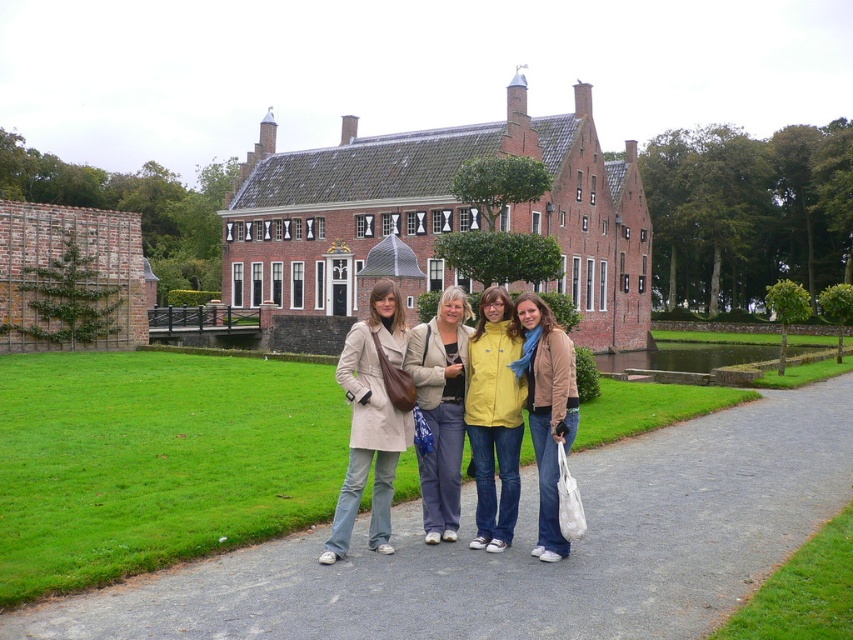
Which is behind, point (35, 634) or point (544, 326)?

The point (544, 326) is more distant.

Does gray asphalt path at center appear under matte beige jacket at center?

Yes, gray asphalt path at center is below matte beige jacket at center.

Which is behind, point (624, 604) or point (535, 362)?

Point (535, 362)

The height and width of the screenshot is (640, 853). I want to click on gray asphalt path at center, so click(527, 547).

Does beige fabric coat at center have a greater width compared to light beige coat at center?

Correct, the width of beige fabric coat at center exceeds that of light beige coat at center.

Is beige fabric coat at center smaller than light beige coat at center?

Indeed, beige fabric coat at center has a smaller size compared to light beige coat at center.

Between point (351, 518) and point (468, 326), which one is positioned in front?

Positioned in front is point (351, 518).

This screenshot has height=640, width=853. I want to click on beige fabric coat at center, so click(x=370, y=419).

Where is `gray asphalt path at center`? This screenshot has width=853, height=640. gray asphalt path at center is located at coordinates (527, 547).

Where is `gray asphalt path at center`? The image size is (853, 640). gray asphalt path at center is located at coordinates (527, 547).

Where is `gray asphalt path at center`? The image size is (853, 640). gray asphalt path at center is located at coordinates (527, 547).